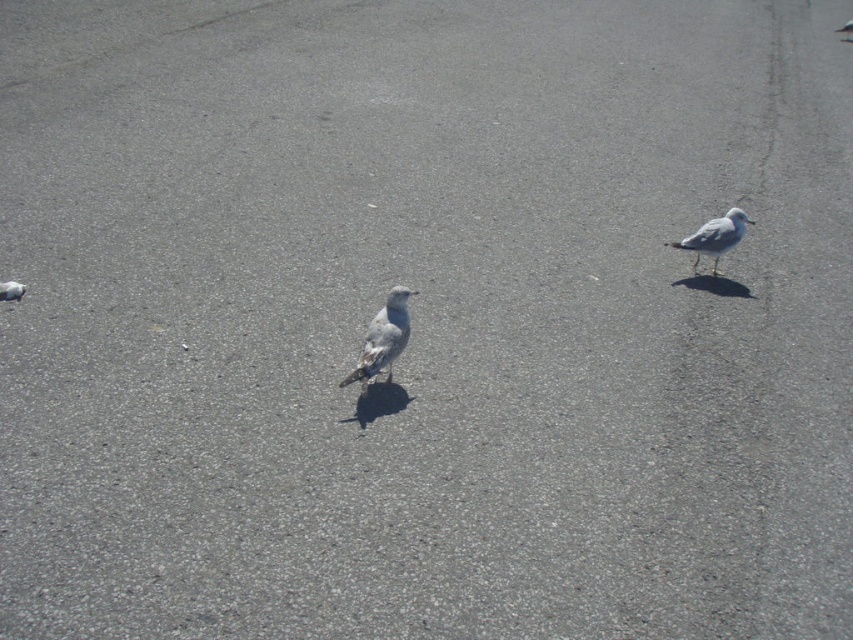
Between white matte pigeon at right and gray matte pigeon at lower left, which one is positioned higher?

Positioned higher is white matte pigeon at right.

Which is in front, point (715, 262) or point (10, 296)?

Point (10, 296)

The height and width of the screenshot is (640, 853). What are the coordinates of `white matte pigeon at right` in the screenshot? It's located at (714, 236).

Is gray matte bird at center wider than white matte pigeon at right?

Incorrect, gray matte bird at center's width does not surpass white matte pigeon at right's.

Does gray matte bird at center appear over white matte pigeon at right?

No, gray matte bird at center is not above white matte pigeon at right.

Is point (392, 362) positioned before point (724, 237)?

Yes, it is.

At what (x,y) coordinates should I click in order to perform the action: click on gray matte bird at center. Please return your answer as a coordinate pair (x, y). The height and width of the screenshot is (640, 853). Looking at the image, I should click on (381, 339).

What do you see at coordinates (381, 339) in the screenshot?
I see `gray matte bird at center` at bounding box center [381, 339].

Between gray matte bird at center and gray matte pigeon at lower left, which one appears on the right side from the viewer's perspective?

From the viewer's perspective, gray matte bird at center appears more on the right side.

The height and width of the screenshot is (640, 853). Identify the location of gray matte bird at center. (381, 339).